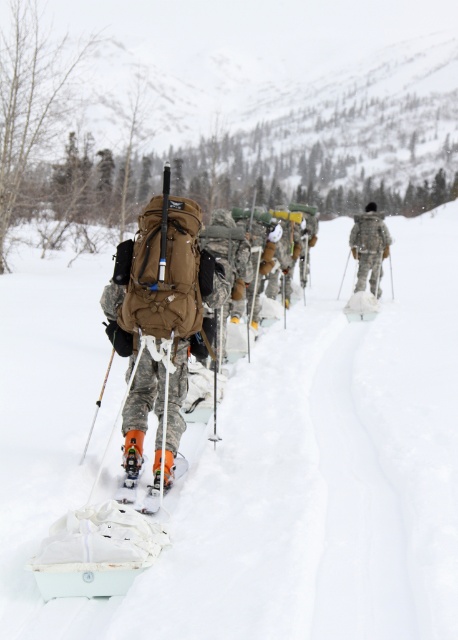
You are a photographer trying to capture a clear shot of both the camouflage fabric uniform at center and the orange matte ski at center in the snowy landscape. Considering their sizes, which object will appear bigger in your photo?

The camouflage fabric uniform at center will appear bigger in the photo since it has a larger size compared to the orange matte ski at center.

You are part of a winter expedition team and need to quickly identify your teammate. You see two items at the center of the scene. Which item is located to the left side of the other? The camouflage fabric backpack at center or the camouflage fabric uniform at center?

The camouflage fabric backpack at center is positioned on the left side of the camouflage fabric uniform at center.

Based on the photo, you are part of the winter expedition team. Your task is to retrieve the orange matte ski at center from its current position. However, you are carrying a camouflage fabric backpack at center. Can you reach the ski without dropping your backpack?

The distance between the camouflage fabric backpack at center and the orange matte ski at center is 69.60 centimeters. Since you are carrying the backpack, you can extend your arm to reach the ski as the distance is within a typical arm length for an adult, so yes, you can retrieve the ski without dropping the backpack.